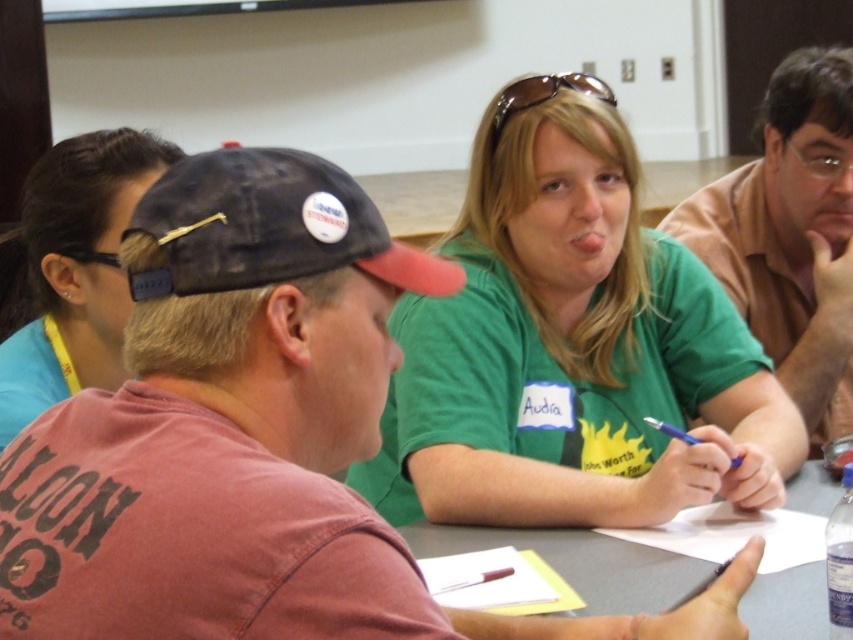
You are an interior designer observing the scene. You need to determine which object is larger between the blue fabric hair clip at upper left and the gray matte table at center. Based on the scene, which one is bigger?

The blue fabric hair clip at upper left is bigger than the gray matte table at center.

You are a person sitting at the gray matte table at center. You need to reach for the blue plastic pen at center during a meeting. Can you comfortably reach the pen without moving your chair?

The gray matte table at center is taller than blue plastic pen at center, so the pen is placed on the table. Since tables are typically designed to allow comfortable reach for items placed on them, you can comfortably reach the blue plastic pen at center without moving your chair.